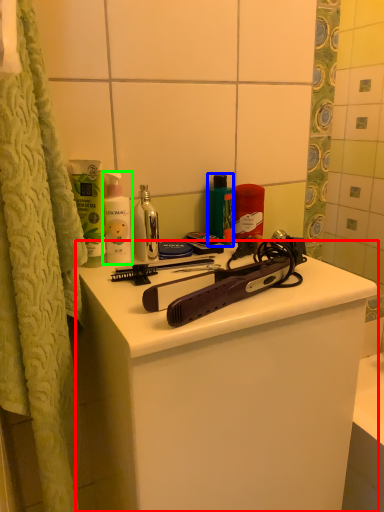
Question: Considering the real-world distances, which object is closest to bathroom cabinet (highlighted by a red box)? mouthwash (highlighted by a blue box) or cleaning product (highlighted by a green box).

Choices:
 (A) mouthwash
 (B) cleaning product

Answer: (B)